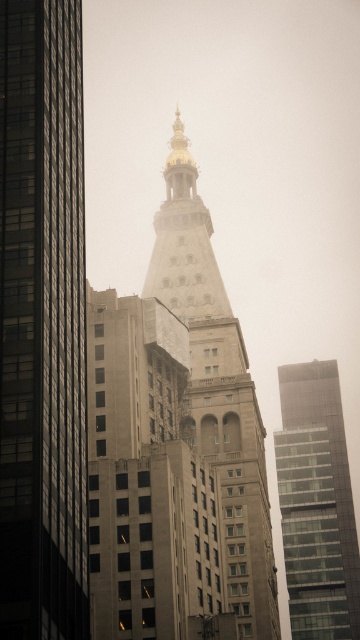
Measure the distance between golden stone tower at center and glassy reflective skyscraper at right.

golden stone tower at center is 44.37 meters from glassy reflective skyscraper at right.

Locate an element on the screen. golden stone tower at center is located at coordinates (217, 392).

Who is positioned more to the left, smooth glass skyscraper at center or golden stone tower at center?

smooth glass skyscraper at center

Is point (29, 547) positioned behind point (264, 560)?

No, it is in front of (264, 560).

I want to click on smooth glass skyscraper at center, so click(x=42, y=323).

Describe the element at coordinates (42, 323) in the screenshot. This screenshot has width=360, height=640. I see `smooth glass skyscraper at center` at that location.

Does smooth glass skyscraper at center come in front of glassy reflective skyscraper at right?

Yes, smooth glass skyscraper at center is in front of glassy reflective skyscraper at right.

Is point (37, 392) behind point (324, 572)?

No, it is not.

Where is `smooth glass skyscraper at center`? smooth glass skyscraper at center is located at coordinates (42, 323).